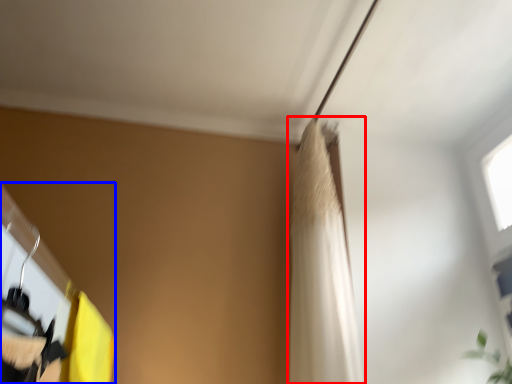
Question: Which of the following is the farthest to the observer, shower curtain (highlighted by a red box) or closet (highlighted by a blue box)?

Choices:
 (A) shower curtain
 (B) closet

Answer: (A)